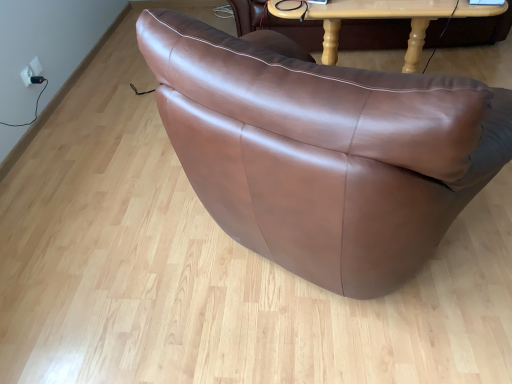
What do you see at coordinates (369, 18) in the screenshot? I see `light brown wooden table at upper center` at bounding box center [369, 18].

Find the location of a particular element. This screenshot has height=384, width=512. light brown wooden table at upper center is located at coordinates (369, 18).

What is the approximate width of light brown wooden table at upper center?

light brown wooden table at upper center is 22.81 inches wide.

Measure the distance between light brown wooden table at upper center and camera.

light brown wooden table at upper center and camera are 1.89 meters apart.

In order to click on white plastic electric outlet at upper left in this screenshot , I will do `click(32, 73)`.

This screenshot has height=384, width=512. What do you see at coordinates (32, 73) in the screenshot? I see `white plastic electric outlet at upper left` at bounding box center [32, 73].

You are a GUI agent. You are given a task and a screenshot of the screen. Output one action in this format:
    pyautogui.click(x=<x>, y=<y>)
    Task: Click on the light brown wooden table at upper center
    
    Given the screenshot: What is the action you would take?
    pyautogui.click(x=369, y=18)

In the scene shown: Is white plastic electric outlet at upper left to the left of light brown wooden table at upper center from the viewer's perspective?

Yes, white plastic electric outlet at upper left is to the left of light brown wooden table at upper center.

Looking at this image, is white plastic electric outlet at upper left closer to the viewer compared to light brown wooden table at upper center?

No, white plastic electric outlet at upper left is behind light brown wooden table at upper center.

Is point (38, 83) closer or farther from the camera than point (307, 12)?

Clearly, point (38, 83) is more distant from the camera than point (307, 12).

From the image's perspective, which object appears higher, white plastic electric outlet at upper left or light brown wooden table at upper center?

light brown wooden table at upper center appears higher in the image.

From a real-world perspective, which object rests below the other?

white plastic electric outlet at upper left is physically lower.

Is white plastic electric outlet at upper left thinner than light brown wooden table at upper center?

Indeed, white plastic electric outlet at upper left has a lesser width compared to light brown wooden table at upper center.

In the scene shown: Considering the sizes of objects white plastic electric outlet at upper left and light brown wooden table at upper center in the image provided, who is shorter, white plastic electric outlet at upper left or light brown wooden table at upper center?

white plastic electric outlet at upper left.

Does white plastic electric outlet at upper left have a larger size compared to light brown wooden table at upper center?

Actually, white plastic electric outlet at upper left might be smaller than light brown wooden table at upper center.

Is light brown wooden table at upper center inside white plastic electric outlet at upper left?

No, light brown wooden table at upper center is located outside of white plastic electric outlet at upper left.

Is white plastic electric outlet at upper left not near light brown wooden table at upper center?

white plastic electric outlet at upper left is far away from light brown wooden table at upper center.

In the scene shown: Is white plastic electric outlet at upper left positioned with its back to light brown wooden table at upper center?

That's not correct — white plastic electric outlet at upper left is not looking away from light brown wooden table at upper center.

Identify the location of electric outlet that is behind the light brown wooden table at upper center. Image resolution: width=512 pixels, height=384 pixels. [x=32, y=73].

Considering the relative positions of light brown wooden table at upper center and white plastic electric outlet at upper left in the image provided, is light brown wooden table at upper center to the right of white plastic electric outlet at upper left from the viewer's perspective?

Yes, light brown wooden table at upper center is to the right of white plastic electric outlet at upper left.

Is light brown wooden table at upper center behind white plastic electric outlet at upper left?

No, light brown wooden table at upper center is closer to the viewer.

Considering the positions of point (417, 20) and point (39, 68), is point (417, 20) closer or farther from the camera than point (39, 68)?

Point (417, 20) is closer to the camera than point (39, 68).

Based on the photo, from the image's perspective, is light brown wooden table at upper center located beneath white plastic electric outlet at upper left?

Incorrect, from the image's perspective, light brown wooden table at upper center is higher than white plastic electric outlet at upper left.

From a real-world perspective, is light brown wooden table at upper center positioned above or below white plastic electric outlet at upper left?

From a real-world perspective, light brown wooden table at upper center is physically above white plastic electric outlet at upper left.

Can you confirm if light brown wooden table at upper center is thinner than white plastic electric outlet at upper left?

Incorrect, the width of light brown wooden table at upper center is not less than that of white plastic electric outlet at upper left.

Between light brown wooden table at upper center and white plastic electric outlet at upper left, which one has more height?

Standing taller between the two is light brown wooden table at upper center.

Consider the image. Considering the sizes of objects light brown wooden table at upper center and white plastic electric outlet at upper left in the image provided, who is smaller, light brown wooden table at upper center or white plastic electric outlet at upper left?

With smaller size is white plastic electric outlet at upper left.

Would you say white plastic electric outlet at upper left is part of light brown wooden table at upper center's contents?

That's incorrect, white plastic electric outlet at upper left is not inside light brown wooden table at upper center.

Is the surface of light brown wooden table at upper center in direct contact with white plastic electric outlet at upper left?

No, light brown wooden table at upper center is not touching white plastic electric outlet at upper left.

Is light brown wooden table at upper center oriented away from white plastic electric outlet at upper left?

That's not correct — light brown wooden table at upper center is not looking away from white plastic electric outlet at upper left.

Can you tell me how much light brown wooden table at upper center and white plastic electric outlet at upper left differ in facing direction?

85 degrees separate the facing orientations of light brown wooden table at upper center and white plastic electric outlet at upper left.

Locate an element on the screen. electric outlet below the light brown wooden table at upper center (from a real-world perspective) is located at coordinates (32, 73).

Identify the location of table above the white plastic electric outlet at upper left (from the image's perspective). The image size is (512, 384). (369, 18).

The width and height of the screenshot is (512, 384). Identify the location of electric outlet that appears below the light brown wooden table at upper center (from the image's perspective). (32, 73).